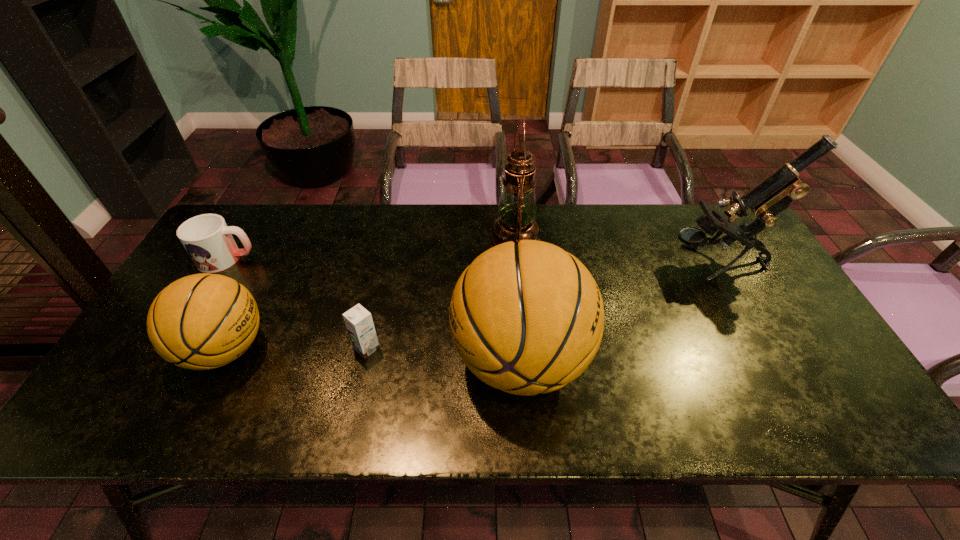
This screenshot has height=540, width=960. I want to click on vacant area that lies between the microscope and the oil lamp, so click(615, 252).

This screenshot has width=960, height=540. Find the location of `empty space between the chocolate milk and the mug`. empty space between the chocolate milk and the mug is located at coordinates (297, 303).

You are a GUI agent. You are given a task and a screenshot of the screen. Output one action in this format:
    pyautogui.click(x=<x>, y=<y>)
    Task: Click on the free space that is in between the mug and the third tallest object
    
    Given the screenshot: What is the action you would take?
    pyautogui.click(x=373, y=309)

Identify the location of vacant area between the mug and the microscope. (471, 261).

Identify the location of vacant space that's between the oil lamp and the rightmost object. This screenshot has height=540, width=960. (615, 252).

Where is `free spot between the left basketball and the chocolate milk`? free spot between the left basketball and the chocolate milk is located at coordinates (296, 349).

At what (x,y) coordinates should I click in order to perform the action: click on free point between the left basketball and the chocolate milk. Please return your answer as a coordinate pair (x, y). Looking at the image, I should click on [x=296, y=349].

Image resolution: width=960 pixels, height=540 pixels. I want to click on object that is the fourth closest to the fourth object from right to left, so click(x=208, y=240).

The image size is (960, 540). I want to click on object that is the fourth closest to the mug, so click(x=516, y=210).

Locate an element on the screen. The image size is (960, 540). vacant position in the image that satisfies the following two spatial constraints: 1. on the front side of the oil lamp; 2. on the surface of the left basketball near the brand logo is located at coordinates (524, 349).